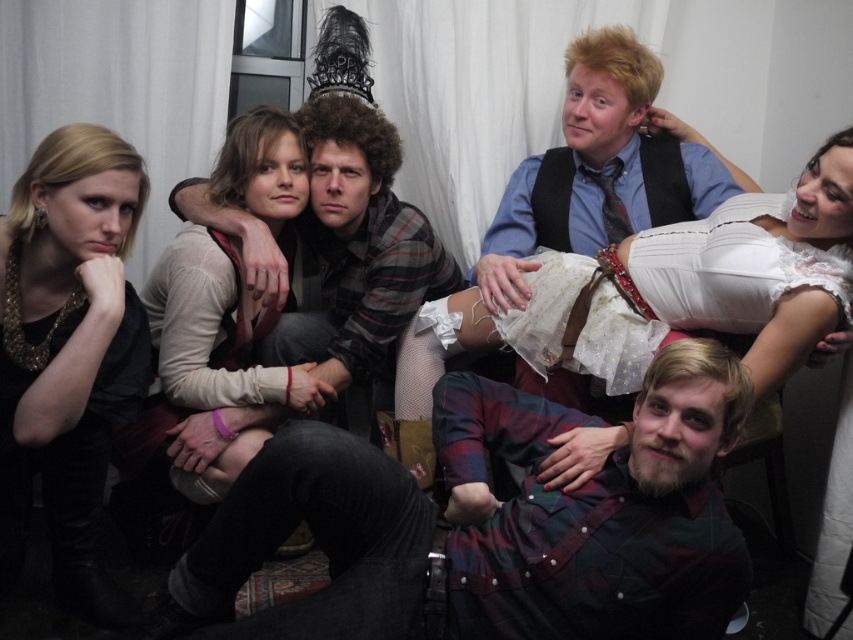
You are a photographer standing in the center of the room. You want to take a photo of the blue shirt at upper right and the plaid flannel shirt at center. Can you fit both subjects into the frame of your camera which has a maximum width of 50 centimeters?

The blue shirt at upper right is 45.05 centimeters away from the plaid flannel shirt at center, so yes, both subjects can fit into the camera frame since the distance between them is less than the maximum width of 50 centimeters.

You are standing in the room where the group is posing. You see two points marked in the image. Which point, point 1 at coordinates (99, 300) or point 2 at coordinates (695, 269), is closer to you?

Point 1 at coordinates (99, 300) is closer to you than point 2 at coordinates (695, 269).

In the scene shown: You are organizing a photo shoot and need to place the matte black shirt at left and the white lace dress at upper right on a rack. Which one requires a larger hanger?

The white lace dress at upper right requires a larger hanger because the matte black shirt at left is smaller than it.